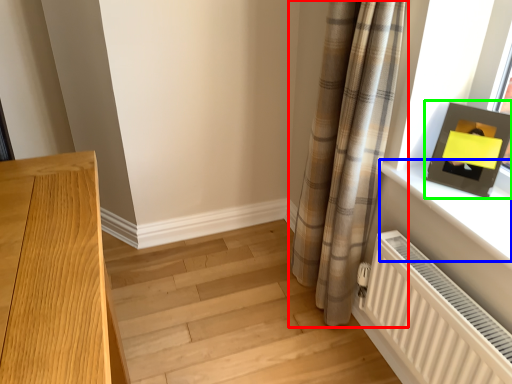
Question: Estimate the real-world distances between objects in this image. Which object is closer to curtain (highlighted by a red box), window sill (highlighted by a blue box) or picture frame (highlighted by a green box)?

Choices:
 (A) window sill
 (B) picture frame

Answer: (A)